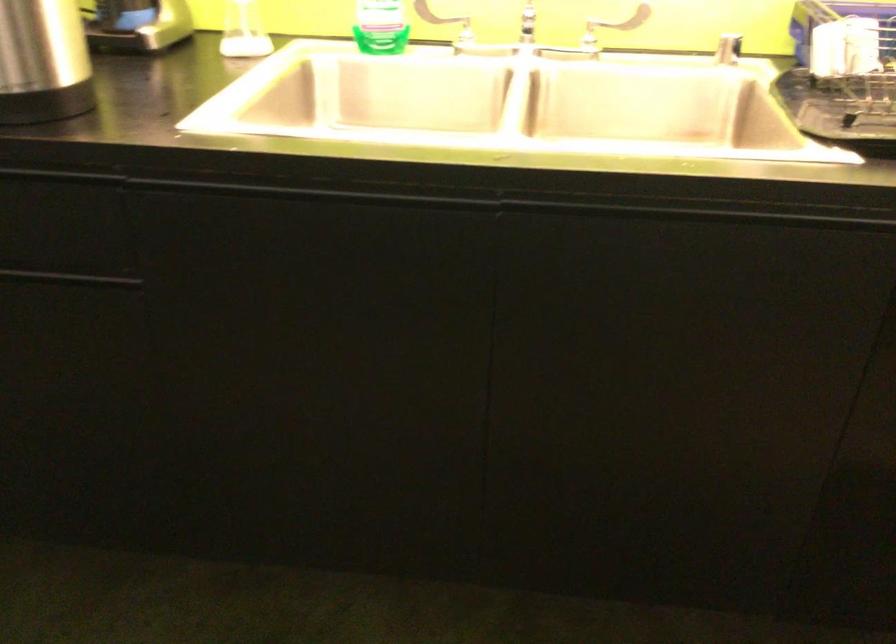
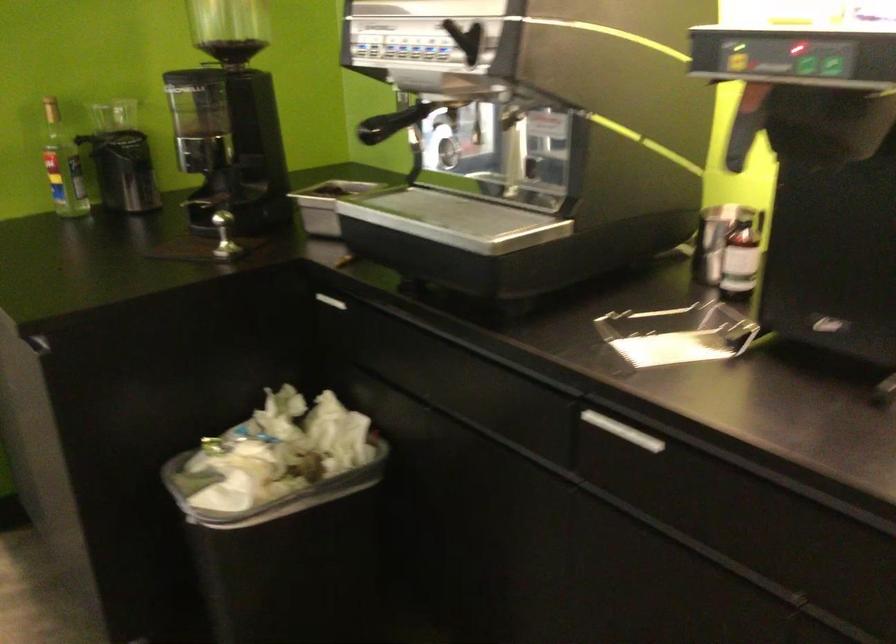
Question: The camera is either moving clockwise (left) or counter-clockwise (right) around the object. The first image is from the beginning of the video and the second image is from the end. Is the camera moving left or right when shooting the video?

Choices:
 (A) Left
 (B) Right

Answer: (B)